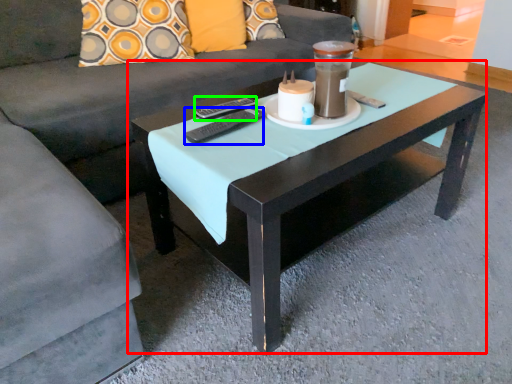
Question: Which object is the closest to the coffee table (highlighted by a red box)? Choose among these: remote (highlighted by a blue box) or remote (highlighted by a green box).

Choices:
 (A) remote
 (B) remote

Answer: (A)